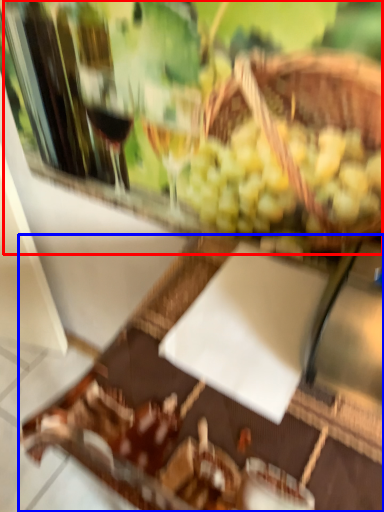
Question: Which object appears closest to the camera in this image, wine tasting (highlighted by a red box) or table (highlighted by a blue box)?

Choices:
 (A) wine tasting
 (B) table

Answer: (B)